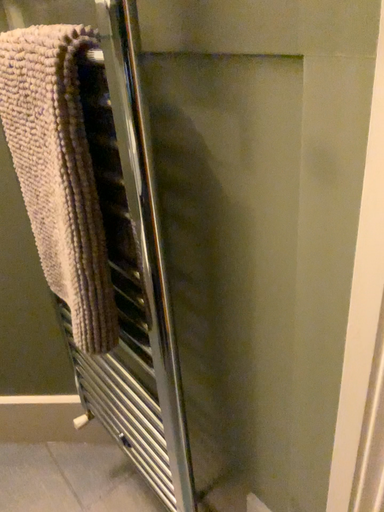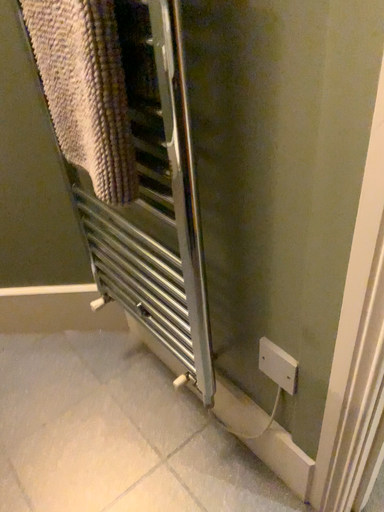
Question: Which way did the camera rotate in the video?

Choices:
 (A) rotated upward
 (B) rotated downward

Answer: (B)